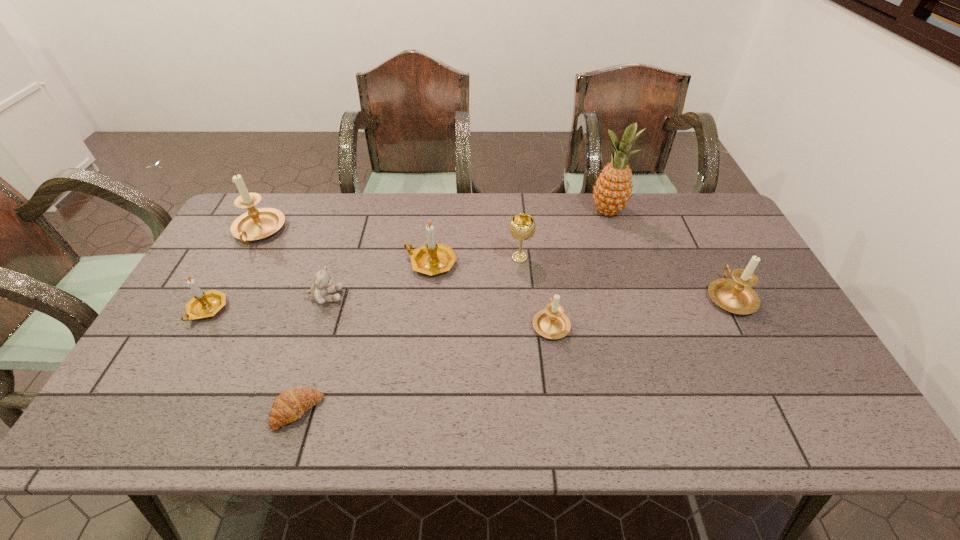
Find the location of a particular element. vacant space that satisfies the following two spatial constraints: 1. with a handle on the side of the leftmost beige candle holder; 2. on the right side of the fifth object from right to left is located at coordinates (242, 263).